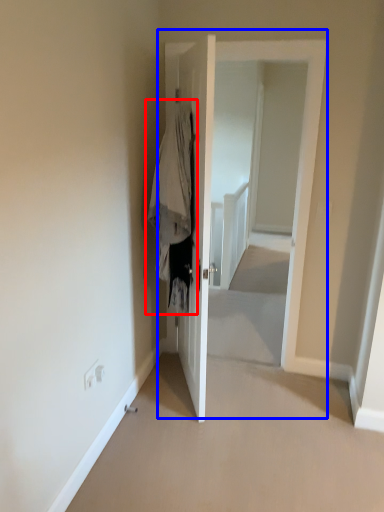
Question: Among these objects, which one is farthest to the camera, clothing (highlighted by a red box) or door (highlighted by a blue box)?

Choices:
 (A) clothing
 (B) door

Answer: (B)